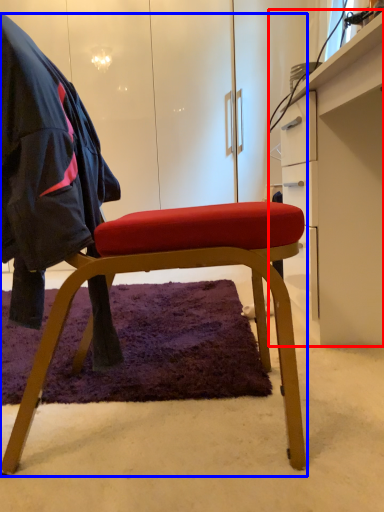
Question: Which point is further to the camera, desk (highlighted by a red box) or chair (highlighted by a blue box)?

Choices:
 (A) desk
 (B) chair

Answer: (A)